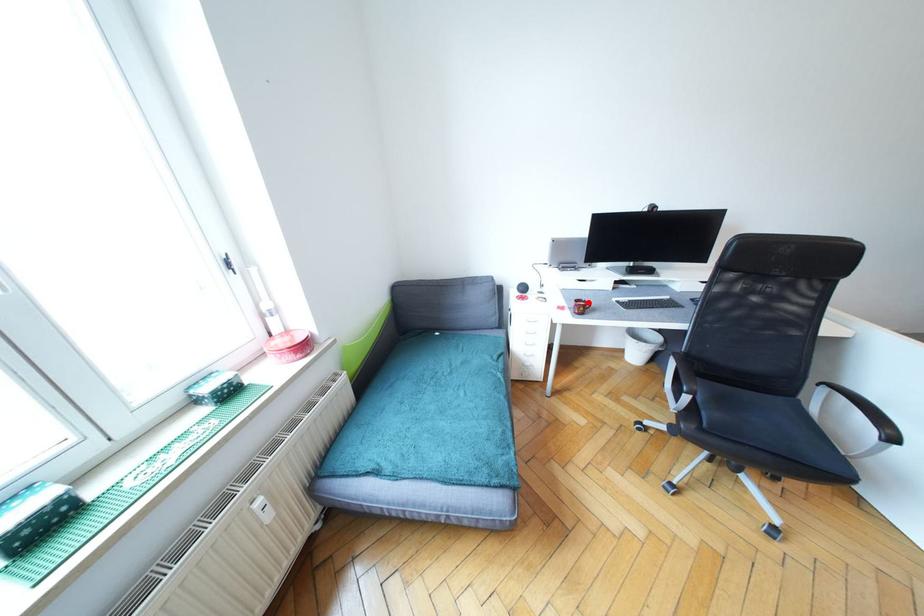
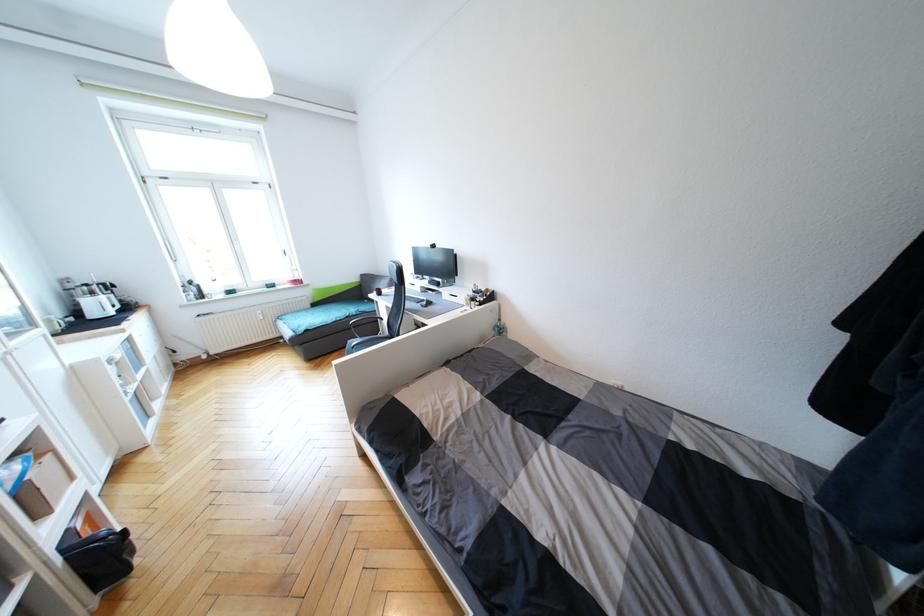
Question: I am providing you with two images of the same scene from different viewpoints. A red point is marked on the first image. At the location where the point appears in image 1, is it still visible in image 2?

Choices:
 (A) Yes
 (B) No

Answer: (B)